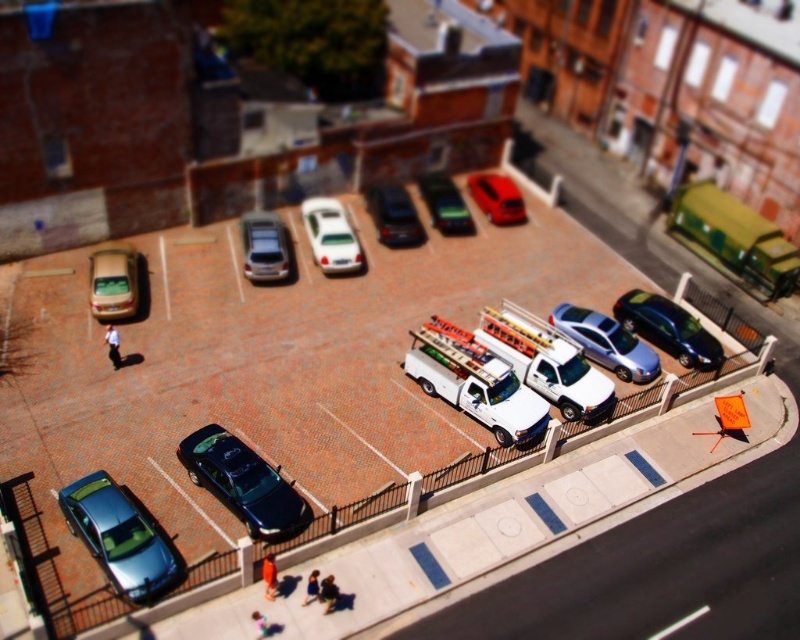
Question: Is shiny black sedan at right below satin silver suv at center?

Choices:
 (A) yes
 (B) no

Answer: (A)

Question: Among these objects, which one is nearest to the camera?

Choices:
 (A) metallic silver van at center
 (B) matte beige car at left
 (C) shiny red sedan at center

Answer: (B)

Question: Which point is farther to the camera?

Choices:
 (A) metallic silver van at center
 (B) shiny red sedan at center
 (C) shiny black car at center

Answer: (B)

Question: Among these objects, which one is nearest to the camera?

Choices:
 (A) shiny black sedan at right
 (B) satin silver suv at center
 (C) shiny red sedan at center
 (D) shiny metallic sedan at lower left

Answer: (D)

Question: Does shiny dark blue sedan at center-left have a lesser width compared to shiny black sedan at right?

Choices:
 (A) no
 (B) yes

Answer: (A)

Question: Is matte beige car at left bigger than shiny red sedan at center?

Choices:
 (A) yes
 (B) no

Answer: (B)